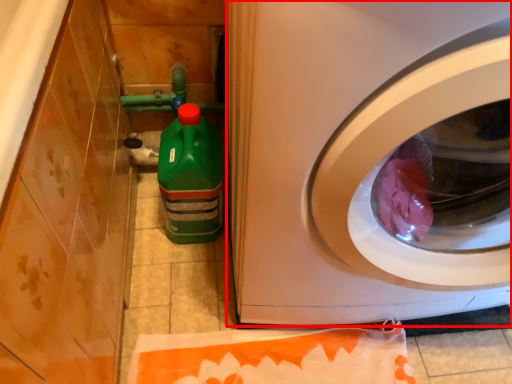
Question: From the image's perspective, what is the correct spatial relationship of washing machine (annotated by the red box) in relation to cleaning product?

Choices:
 (A) above
 (B) below

Answer: (A)